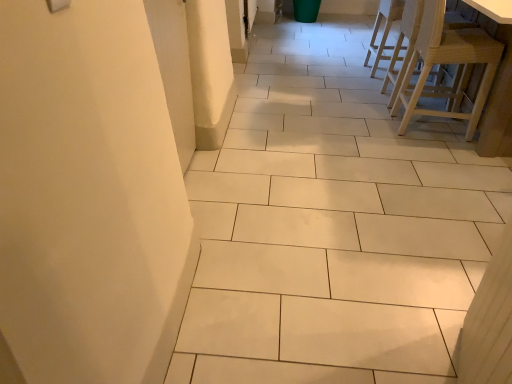
Question: Considering the relative sizes of light wood stool at right, positioned as the third chair in back-to-front order, and natural wood chair at upper right, acting as the second chair starting from the front, in the image provided, is light wood stool at right, positioned as the third chair in back-to-front order, wider than natural wood chair at upper right, acting as the second chair starting from the front,?

Choices:
 (A) yes
 (B) no

Answer: (B)

Question: Is light wood stool at right, which is the 1th chair from front to back, touching natural wood chair at upper right, the 2th chair when ordered from back to front?

Choices:
 (A) no
 (B) yes

Answer: (A)

Question: Is the position of light wood stool at right, positioned as the third chair in back-to-front order, less distant than that of natural wood chair at upper right, acting as the second chair starting from the front?

Choices:
 (A) no
 (B) yes

Answer: (B)

Question: Is light wood stool at right, which is the 1th chair from front to back, surrounding natural wood chair at upper right, the 2th chair when ordered from back to front?

Choices:
 (A) no
 (B) yes

Answer: (A)

Question: Is light wood stool at right, positioned as the third chair in back-to-front order, not inside natural wood chair at upper right, the 2th chair when ordered from back to front?

Choices:
 (A) yes
 (B) no

Answer: (A)

Question: Considering the positions of point (457, 94) and point (375, 33), is point (457, 94) closer or farther from the camera than point (375, 33)?

Choices:
 (A) closer
 (B) farther

Answer: (A)

Question: Looking at their shapes, would you say light wood stool at right, positioned as the third chair in back-to-front order, is wider or thinner than light wood chair at upper right, marked as the 3th chair in a front-to-back arrangement?

Choices:
 (A) wide
 (B) thin

Answer: (A)

Question: From a real-world perspective, is light wood stool at right, positioned as the third chair in back-to-front order, above or below light wood chair at upper right, marked as the 3th chair in a front-to-back arrangement?

Choices:
 (A) above
 (B) below

Answer: (A)

Question: In terms of height, does light wood stool at right, which is the 1th chair from front to back, look taller or shorter compared to light wood chair at upper right, which is the first chair from back to front?

Choices:
 (A) tall
 (B) short

Answer: (A)

Question: Relative to natural wood chair at upper right, acting as the second chair starting from the front, is light wood stool at right, positioned as the third chair in back-to-front order, in front or behind?

Choices:
 (A) behind
 (B) front

Answer: (B)

Question: Considering the positions of point (414, 48) and point (415, 13), is point (414, 48) closer or farther from the camera than point (415, 13)?

Choices:
 (A) farther
 (B) closer

Answer: (A)

Question: In the image, is light wood stool at right, which is the 1th chair from front to back, on the left side or the right side of natural wood chair at upper right, acting as the second chair starting from the front?

Choices:
 (A) left
 (B) right

Answer: (A)

Question: Is light wood stool at right, which is the 1th chair from front to back, situated inside natural wood chair at upper right, acting as the second chair starting from the front, or outside?

Choices:
 (A) outside
 (B) inside

Answer: (A)

Question: Is point (419, 16) closer or farther from the camera than point (379, 52)?

Choices:
 (A) farther
 (B) closer

Answer: (B)

Question: Based on their sizes in the image, would you say natural wood chair at upper right, acting as the second chair starting from the front, is bigger or smaller than light wood chair at upper right, which is the first chair from back to front?

Choices:
 (A) big
 (B) small

Answer: (A)